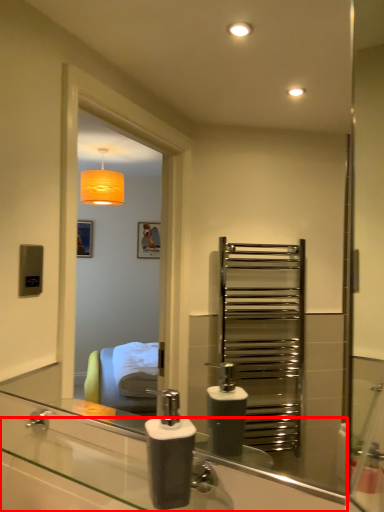
Question: From the image's perspective, considering the relative positions of counter top (annotated by the red box) and soap dispenser in the image provided, where is counter top (annotated by the red box) located with respect to the staircase?

Choices:
 (A) below
 (B) above

Answer: (A)